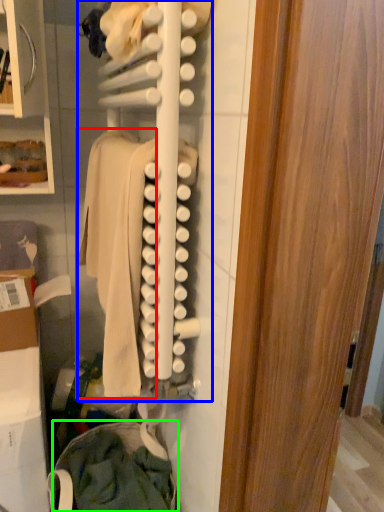
Question: Considering the real-world distances, which object is farthest from clothing (highlighted by a red box)? closet (highlighted by a blue box) or clothing (highlighted by a green box)?

Choices:
 (A) closet
 (B) clothing

Answer: (B)